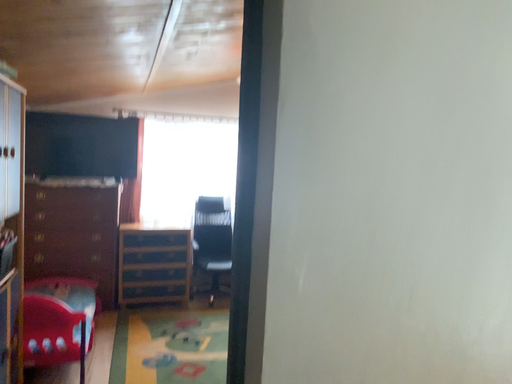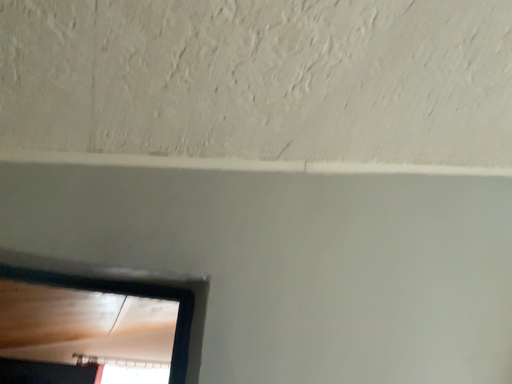
Question: How did the camera likely rotate when shooting the video?

Choices:
 (A) rotated downward
 (B) rotated upward

Answer: (B)